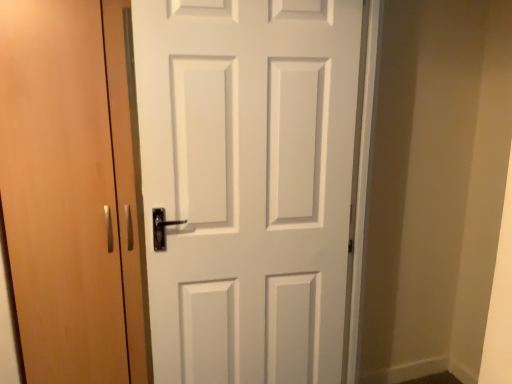
The height and width of the screenshot is (384, 512). I want to click on light brown wood door at left, the second door when ordered from right to left, so [x=60, y=192].

The width and height of the screenshot is (512, 384). What do you see at coordinates (60, 192) in the screenshot?
I see `light brown wood door at left, which appears as the 1th door when viewed from the left` at bounding box center [60, 192].

Find the location of a particular element. The image size is (512, 384). white matte door at center, the 1th door in the right-to-left sequence is located at coordinates (247, 184).

This screenshot has height=384, width=512. What do you see at coordinates (247, 184) in the screenshot? I see `white matte door at center, which ranks as the 2th door in left-to-right order` at bounding box center [247, 184].

The width and height of the screenshot is (512, 384). Find the location of `light brown wood door at left, the second door when ordered from right to left`. light brown wood door at left, the second door when ordered from right to left is located at coordinates (60, 192).

Considering the positions of objects white matte door at center, the 1th door in the right-to-left sequence, and light brown wood door at left, which appears as the 1th door when viewed from the left, in the image provided, who is more to the left, white matte door at center, the 1th door in the right-to-left sequence, or light brown wood door at left, which appears as the 1th door when viewed from the left,?

light brown wood door at left, which appears as the 1th door when viewed from the left.

Is white matte door at center, the 1th door in the right-to-left sequence, in front of light brown wood door at left, the second door when ordered from right to left?

Yes, it is.

Consider the image. Which is less distant, (239,81) or (76,290)?

Point (239,81) is closer to the camera than point (76,290).

From the image's perspective, which one is positioned lower, white matte door at center, the 1th door in the right-to-left sequence, or light brown wood door at left, the second door when ordered from right to left?

white matte door at center, the 1th door in the right-to-left sequence, from the image's perspective.

Consider the image. From a real-world perspective, which is physically below, white matte door at center, which ranks as the 2th door in left-to-right order, or light brown wood door at left, the second door when ordered from right to left?

light brown wood door at left, the second door when ordered from right to left, from a real-world perspective.

Is white matte door at center, the 1th door in the right-to-left sequence, wider than light brown wood door at left, the second door when ordered from right to left?

Incorrect, the width of white matte door at center, the 1th door in the right-to-left sequence, does not surpass that of light brown wood door at left, the second door when ordered from right to left.

Does white matte door at center, the 1th door in the right-to-left sequence, have a lesser height compared to light brown wood door at left, which appears as the 1th door when viewed from the left?

Yes.

Can you confirm if white matte door at center, the 1th door in the right-to-left sequence, is bigger than light brown wood door at left, the second door when ordered from right to left?

Actually, white matte door at center, the 1th door in the right-to-left sequence, might be smaller than light brown wood door at left, the second door when ordered from right to left.

Would you say white matte door at center, which ranks as the 2th door in left-to-right order, is outside light brown wood door at left, the second door when ordered from right to left?

Yes.

Is white matte door at center, which ranks as the 2th door in left-to-right order, beside light brown wood door at left, the second door when ordered from right to left?

No, white matte door at center, which ranks as the 2th door in left-to-right order, is not in contact with light brown wood door at left, the second door when ordered from right to left.

Is white matte door at center, which ranks as the 2th door in left-to-right order, facing away from light brown wood door at left, which appears as the 1th door when viewed from the left?

No.

How many degrees apart are the facing directions of white matte door at center, which ranks as the 2th door in left-to-right order, and light brown wood door at left, the second door when ordered from right to left?

The angular difference between white matte door at center, which ranks as the 2th door in left-to-right order, and light brown wood door at left, the second door when ordered from right to left, is 5.55 degrees.

Find the location of a particular element. door in front of the light brown wood door at left, which appears as the 1th door when viewed from the left is located at coordinates (247, 184).

Is light brown wood door at left, which appears as the 1th door when viewed from the left, at the left side of white matte door at center, which ranks as the 2th door in left-to-right order?

Indeed, light brown wood door at left, which appears as the 1th door when viewed from the left, is positioned on the left side of white matte door at center, which ranks as the 2th door in left-to-right order.

Which is in front, light brown wood door at left, which appears as the 1th door when viewed from the left, or white matte door at center, the 1th door in the right-to-left sequence?

Positioned in front is white matte door at center, the 1th door in the right-to-left sequence.

Which is behind, point (46, 156) or point (260, 216)?

The point (260, 216) is behind.

From the image's perspective, is light brown wood door at left, which appears as the 1th door when viewed from the left, over white matte door at center, the 1th door in the right-to-left sequence?

Yes, from the image's perspective, light brown wood door at left, which appears as the 1th door when viewed from the left, is over white matte door at center, the 1th door in the right-to-left sequence.

From a real-world perspective, is light brown wood door at left, the second door when ordered from right to left, positioned under white matte door at center, the 1th door in the right-to-left sequence, based on gravity?

Indeed, from a real-world perspective, light brown wood door at left, the second door when ordered from right to left, is positioned beneath white matte door at center, the 1th door in the right-to-left sequence.

Does light brown wood door at left, which appears as the 1th door when viewed from the left, have a lesser width compared to white matte door at center, which ranks as the 2th door in left-to-right order?

In fact, light brown wood door at left, which appears as the 1th door when viewed from the left, might be wider than white matte door at center, which ranks as the 2th door in left-to-right order.

In terms of height, does light brown wood door at left, the second door when ordered from right to left, look taller or shorter compared to white matte door at center, which ranks as the 2th door in left-to-right order?

In the image, light brown wood door at left, the second door when ordered from right to left, appears to be taller than white matte door at center, which ranks as the 2th door in left-to-right order.

Is light brown wood door at left, the second door when ordered from right to left, bigger than white matte door at center, the 1th door in the right-to-left sequence?

Correct, light brown wood door at left, the second door when ordered from right to left, is larger in size than white matte door at center, the 1th door in the right-to-left sequence.

Is light brown wood door at left, the second door when ordered from right to left, inside or outside of white matte door at center, which ranks as the 2th door in left-to-right order?

light brown wood door at left, the second door when ordered from right to left, is located beyond the bounds of white matte door at center, which ranks as the 2th door in left-to-right order.

Does light brown wood door at left, which appears as the 1th door when viewed from the left, turn towards white matte door at center, the 1th door in the right-to-left sequence?

No, light brown wood door at left, which appears as the 1th door when viewed from the left, is not turned towards white matte door at center, the 1th door in the right-to-left sequence.

Can you tell me how much light brown wood door at left, which appears as the 1th door when viewed from the left, and white matte door at center, the 1th door in the right-to-left sequence, differ in facing direction?

light brown wood door at left, which appears as the 1th door when viewed from the left, and white matte door at center, the 1th door in the right-to-left sequence, are facing 5.55 degrees away from each other.

This screenshot has height=384, width=512. What are the coordinates of `door above the white matte door at center, which ranks as the 2th door in left-to-right order (from the image's perspective)` in the screenshot? It's located at (60, 192).

Locate an element on the screen. This screenshot has width=512, height=384. door located behind the white matte door at center, the 1th door in the right-to-left sequence is located at coordinates (60, 192).

Image resolution: width=512 pixels, height=384 pixels. In order to click on door to the left of white matte door at center, the 1th door in the right-to-left sequence in this screenshot , I will do `click(60, 192)`.